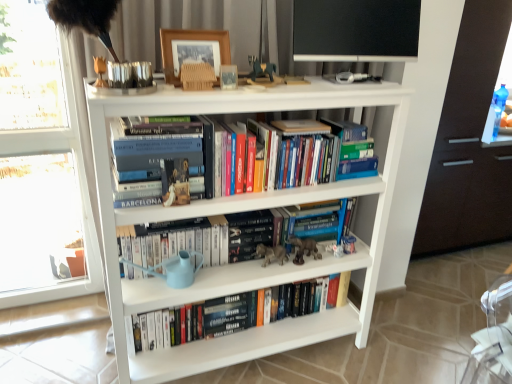
Question: Should I look upward or downward to see transparent glass screen door at right?

Choices:
 (A) up
 (B) down

Answer: (A)

Question: Does dark brown wood drawer at right contain black matte paperback book at center?

Choices:
 (A) no
 (B) yes

Answer: (A)

Question: Would you say dark brown wood drawer at right is outside black matte paperback book at center?

Choices:
 (A) yes
 (B) no

Answer: (A)

Question: Is dark brown wood drawer at right next to black matte paperback book at center?

Choices:
 (A) yes
 (B) no

Answer: (B)

Question: Considering the relative positions of dark brown wood drawer at right and black matte paperback book at center in the image provided, is dark brown wood drawer at right to the right of black matte paperback book at center from the viewer's perspective?

Choices:
 (A) yes
 (B) no

Answer: (A)

Question: Is there a large distance between dark brown wood drawer at right and black matte paperback book at center?

Choices:
 (A) yes
 (B) no

Answer: (A)

Question: Does dark brown wood drawer at right have a smaller size compared to black matte paperback book at center?

Choices:
 (A) no
 (B) yes

Answer: (A)

Question: From a real-world perspective, does matte brown figurine at center sit lower than transparent glass screen door at right?

Choices:
 (A) yes
 (B) no

Answer: (A)

Question: From a real-world perspective, does matte brown figurine at center stand above transparent glass screen door at right?

Choices:
 (A) no
 (B) yes

Answer: (A)

Question: Is matte brown figurine at center closer to the viewer compared to transparent glass screen door at right?

Choices:
 (A) yes
 (B) no

Answer: (A)

Question: Is matte brown figurine at center not within transparent glass screen door at right?

Choices:
 (A) no
 (B) yes

Answer: (B)

Question: Can you confirm if matte brown figurine at center is smaller than transparent glass screen door at right?

Choices:
 (A) yes
 (B) no

Answer: (A)

Question: Is transparent glass screen door at right located within matte brown figurine at center?

Choices:
 (A) no
 (B) yes

Answer: (A)

Question: Can you confirm if matte brown figurine at center is shorter than dark brown wood drawer at right?

Choices:
 (A) no
 (B) yes

Answer: (B)